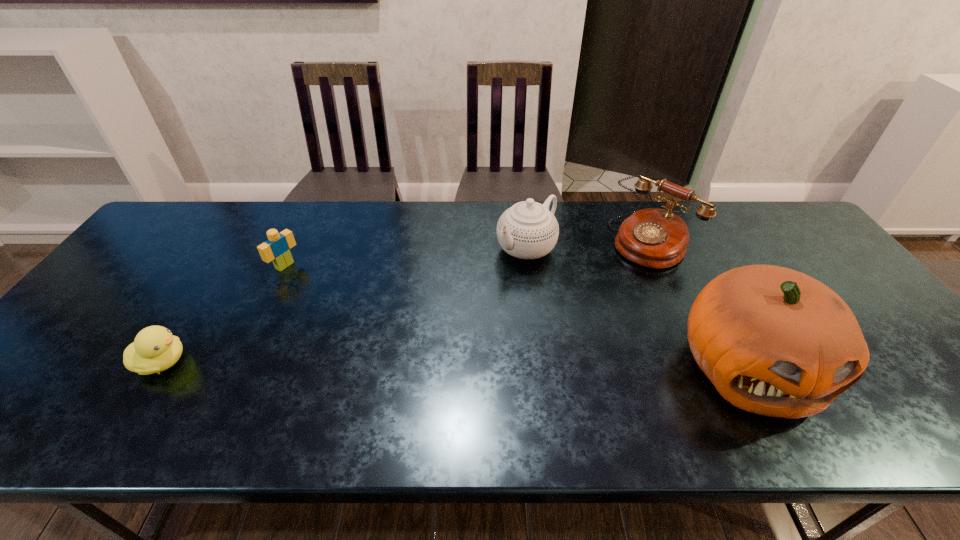
Where is `vacant area at the far edge`? The height and width of the screenshot is (540, 960). vacant area at the far edge is located at coordinates (372, 227).

Find the location of a particular element. blank space at the near edge of the desktop is located at coordinates (368, 396).

Image resolution: width=960 pixels, height=540 pixels. In the image, there is a desktop. Identify the location of vacant space at the far left corner. (174, 213).

At what (x,y) coordinates should I click in order to perform the action: click on blank region between the tallest object and the chinaware. Please return your answer as a coordinate pair (x, y). The height and width of the screenshot is (540, 960). Looking at the image, I should click on (636, 307).

The image size is (960, 540). I want to click on free space between the second object from left to right and the shortest object, so click(224, 314).

At what (x,y) coordinates should I click in order to perform the action: click on free space between the shortest object and the tallest object. Please return your answer as a coordinate pair (x, y). This screenshot has height=540, width=960. Looking at the image, I should click on (454, 364).

Find the location of a particular element. vacant space in between the telephone and the third object from right to left is located at coordinates (589, 244).

Locate an element on the screen. The image size is (960, 540). free space between the Lego and the leftmost object is located at coordinates (224, 314).

This screenshot has height=540, width=960. I want to click on vacant area between the telephone and the chinaware, so click(589, 244).

The width and height of the screenshot is (960, 540). What are the coordinates of `empty location between the fourth object from right to left and the telephone` in the screenshot? It's located at click(x=468, y=253).